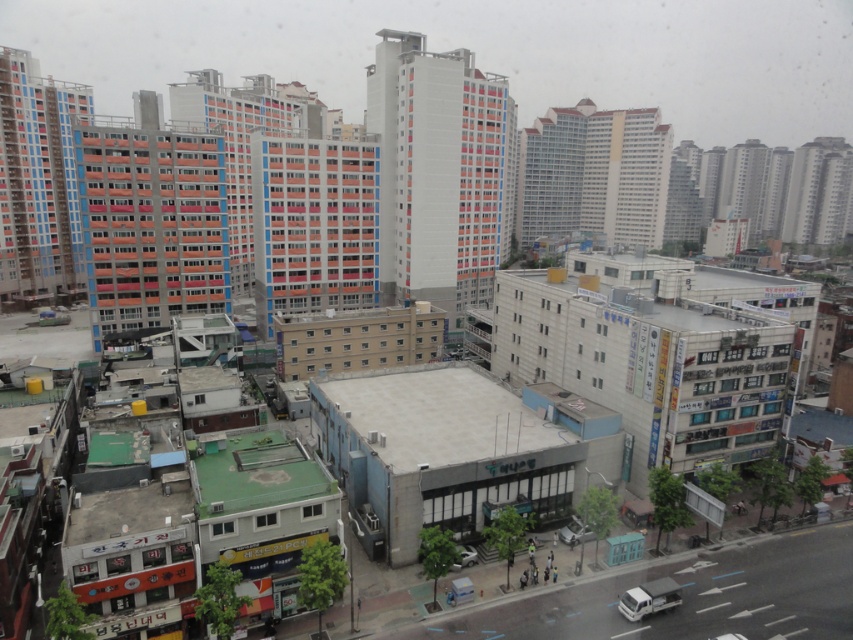
Question: Can you confirm if white matte van at lower right is positioned below white matte car at center?

Choices:
 (A) no
 (B) yes

Answer: (B)

Question: Estimate the real-world distances between objects in this image. Which object is closer to the white matte van at lower right?

Choices:
 (A) metallic silver car at center
 (B) white matte car at center

Answer: (B)

Question: Which object is the farthest from the white matte car at center?

Choices:
 (A) white matte van at lower right
 (B) metallic silver car at center

Answer: (A)

Question: Which object appears closest to the camera in this image?

Choices:
 (A) white matte van at lower right
 (B) white matte car at center
 (C) metallic silver car at center

Answer: (A)

Question: Does white matte car at center have a smaller size compared to metallic silver car at center?

Choices:
 (A) no
 (B) yes

Answer: (B)

Question: Is white matte car at center positioned in front of metallic silver car at center?

Choices:
 (A) yes
 (B) no

Answer: (B)